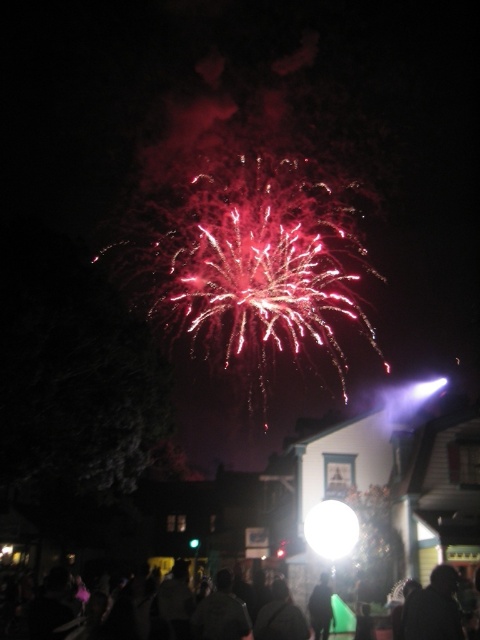
Consider the image. Can you confirm if black matte person at lower right is positioned to the left of black matte jacket at lower center?

In fact, black matte person at lower right is to the right of black matte jacket at lower center.

Does black matte person at lower right have a smaller size compared to black matte jacket at lower center?

Yes, black matte person at lower right is smaller than black matte jacket at lower center.

Between point (444, 620) and point (312, 596), which one is positioned in front?

Point (444, 620)

In order to click on black matte person at lower right in this screenshot , I will do `click(433, 609)`.

Can you confirm if black fabric crowd at lower center is smaller than black matte person at lower right?

Actually, black fabric crowd at lower center might be larger than black matte person at lower right.

Who is positioned more to the right, black fabric crowd at lower center or black matte person at lower right?

black matte person at lower right is more to the right.

The width and height of the screenshot is (480, 640). Describe the element at coordinates (14, 602) in the screenshot. I see `black fabric crowd at lower center` at that location.

This screenshot has width=480, height=640. In order to click on black fabric crowd at lower center in this screenshot , I will do `click(14, 602)`.

Which is more to the right, black matte person at lower right or bright white sphere at center?

Positioned to the right is black matte person at lower right.

Who is taller, black matte person at lower right or bright white sphere at center?

Standing taller between the two is bright white sphere at center.

What do you see at coordinates (433, 609) in the screenshot? Image resolution: width=480 pixels, height=640 pixels. I see `black matte person at lower right` at bounding box center [433, 609].

The width and height of the screenshot is (480, 640). What are the coordinates of `black matte person at lower right` in the screenshot? It's located at (433, 609).